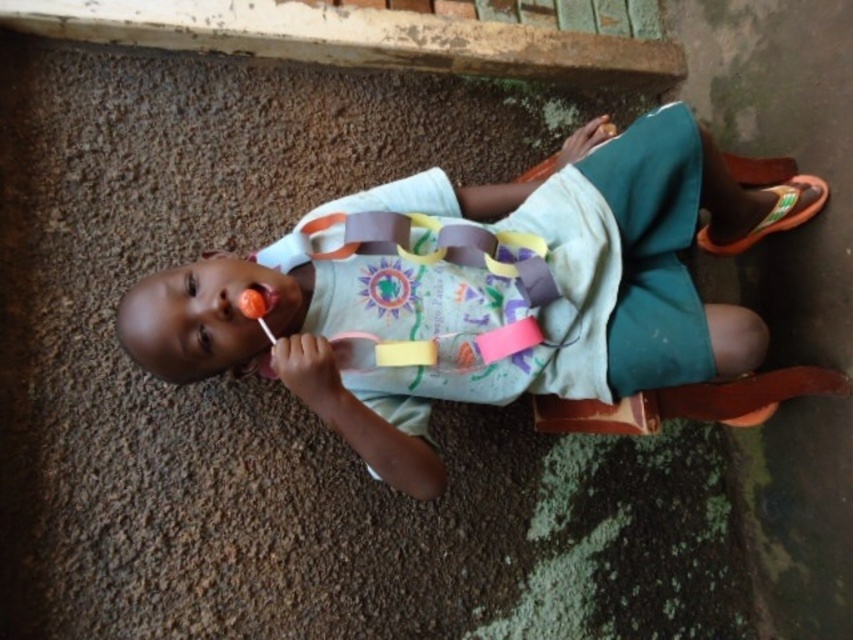
The child is holding a matte plastic lollipop at center and a yellow paper strap at center. Which object is wider?

The matte plastic lollipop at center is wider than the yellow paper strap at center.

The child is holding a matte plastic lollipop at center. The child wants to place the lollipop on the ground near their feet. Considering the ground material and the presence of moss or algae, will the lollipop stay upright?

The ground beneath the child is rough and textured, possibly concrete, and has moss or algae near the feet. The moss or algae might make the surface slippery or uneven, so the matte plastic lollipop at center may not stay upright unless placed carefully on a stable spot.

You are a photographer trying to capture the matte plastic lollipop at center and the orange fabric sandal at right in the same frame. Based on their positions, will the lollipop be visible behind the sandal or in front of it?

The matte plastic lollipop at center is below the orange fabric sandal at right, so the lollipop will be visible behind the sandal.